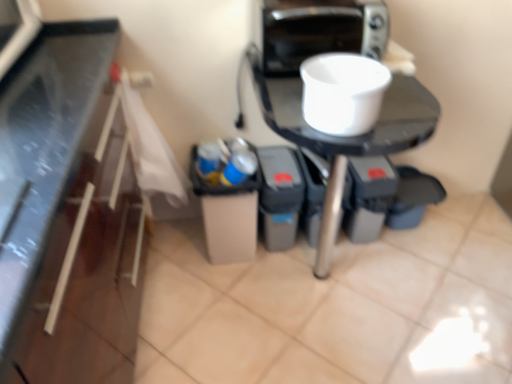
Question: Is blue plastic cup at center completely or partially outside of metallic silver toaster at upper right?

Choices:
 (A) no
 (B) yes

Answer: (B)

Question: Is blue plastic cup at center positioned before metallic silver toaster at upper right?

Choices:
 (A) yes
 (B) no

Answer: (B)

Question: Is blue plastic cup at center facing away from metallic silver toaster at upper right?

Choices:
 (A) no
 (B) yes

Answer: (A)

Question: Is blue plastic cup at center oriented towards metallic silver toaster at upper right?

Choices:
 (A) no
 (B) yes

Answer: (A)

Question: Does blue plastic cup at center appear on the left side of metallic silver toaster at upper right?

Choices:
 (A) yes
 (B) no

Answer: (A)

Question: Considering the positions of point (343, 3) and point (332, 54), is point (343, 3) closer or farther from the camera than point (332, 54)?

Choices:
 (A) closer
 (B) farther

Answer: (A)

Question: In terms of width, does metallic silver toaster at upper right look wider or thinner when compared to white matte bowl at upper center?

Choices:
 (A) wide
 (B) thin

Answer: (A)

Question: Based on their positions, is metallic silver toaster at upper right located to the left or right of white matte bowl at upper center?

Choices:
 (A) left
 (B) right

Answer: (A)

Question: From their relative heights in the image, would you say metallic silver toaster at upper right is taller or shorter than white matte bowl at upper center?

Choices:
 (A) tall
 (B) short

Answer: (A)

Question: From a real-world perspective, is blue plastic cup at center positioned above or below white glossy table at center?

Choices:
 (A) below
 (B) above

Answer: (B)

Question: Considering the relative positions of blue plastic cup at center and white glossy table at center in the image provided, is blue plastic cup at center to the left or to the right of white glossy table at center?

Choices:
 (A) left
 (B) right

Answer: (A)

Question: Considering the positions of blue plastic cup at center and white glossy table at center in the image, is blue plastic cup at center taller or shorter than white glossy table at center?

Choices:
 (A) tall
 (B) short

Answer: (B)

Question: From the image's perspective, relative to white glossy table at center, is blue plastic cup at center above or below?

Choices:
 (A) above
 (B) below

Answer: (A)

Question: Relative to blue plastic cup at center, is white glossy table at center in front or behind?

Choices:
 (A) behind
 (B) front

Answer: (B)

Question: In terms of height, does white glossy table at center look taller or shorter compared to blue plastic cup at center?

Choices:
 (A) tall
 (B) short

Answer: (A)